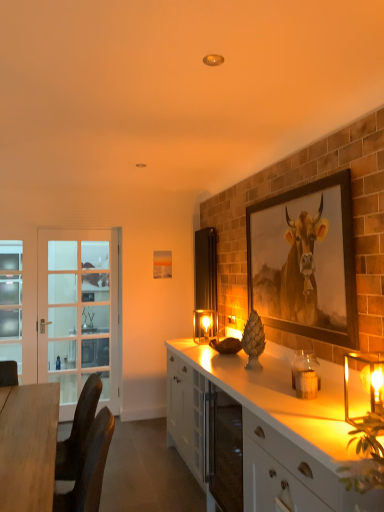
Identify the location of blank space above white glossy cabinet at lower right, the first cabinetry from the front (from a real-world perspective). Image resolution: width=384 pixels, height=512 pixels. (340, 402).